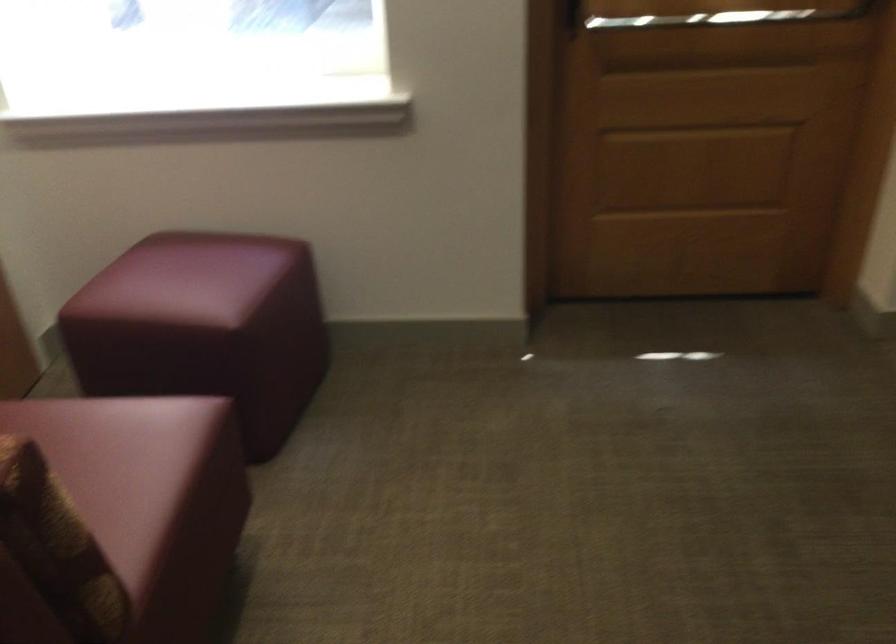
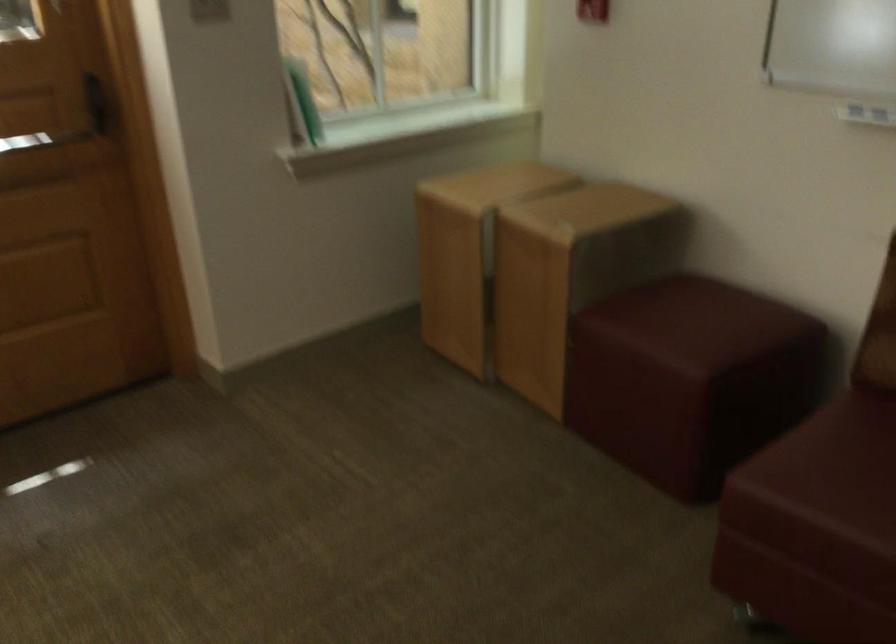
Question: The first image is from the beginning of the video and the second image is from the end. How did the camera likely rotate when shooting the video?

Choices:
 (A) Left
 (B) Right
 (C) Up
 (D) Down

Answer: (B)